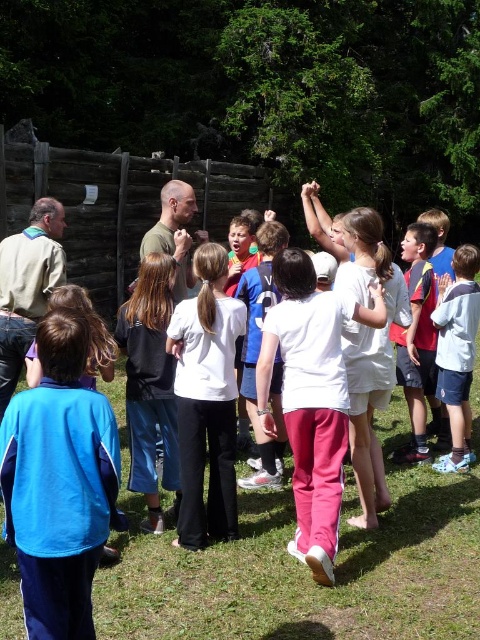
You are a photographer trying to capture a photo of the group. You notice two people wearing a black fabric jacket at center and a white cotton shirt at center. Which one is located to the left of the other?

The black fabric jacket at center is positioned on the left side of white cotton shirt at center.

You are standing at the wooden fence in the background and want to walk towards the point marked as point (157, 516). Will you pass by point (476, 305) before reaching your destination?

Yes, because point (157, 516) is in front of point (476, 305). So when moving towards point (157, 516), you would first pass point (476, 305) before reaching the destination.

You are a photographer standing at the center of the grassy area. You want to capture a photo that includes the blue fabric jacket at lower left. What is the approximate coordinate where you should focus your camera?

The blue fabric jacket at lower left is located at coordinate point (59, 483), so you should focus your camera there to capture it.